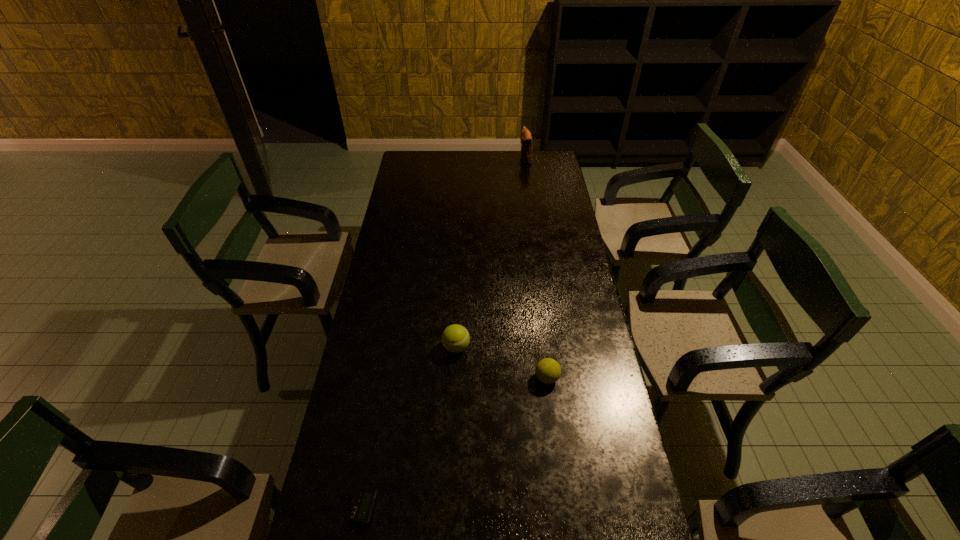
Where is `vacant space at the right edge of the desktop`? The image size is (960, 540). vacant space at the right edge of the desktop is located at coordinates (576, 424).

I want to click on free space at the far left corner of the desktop, so click(x=414, y=164).

The height and width of the screenshot is (540, 960). In order to click on empty space that is in between the nearer tennis ball and the shortest object in this screenshot , I will do `click(455, 443)`.

At what (x,y) coordinates should I click in order to perform the action: click on unoccupied position between the nearer tennis ball and the clutch bag. Please return your answer as a coordinate pair (x, y). The image size is (960, 540). Looking at the image, I should click on 536,268.

I want to click on vacant area that lies between the farthest object and the right tennis ball, so click(x=536, y=268).

This screenshot has height=540, width=960. In order to click on vacant space that is in between the tallest object and the second tallest object in this screenshot , I will do `click(491, 253)`.

At what (x,y) coordinates should I click in order to perform the action: click on free space between the left tennis ball and the shorter tennis ball. Please return your answer as a coordinate pair (x, y). Image resolution: width=960 pixels, height=540 pixels. Looking at the image, I should click on (501, 362).

Locate an element on the screen. empty location between the nearest object and the second object from left to right is located at coordinates pyautogui.click(x=410, y=428).

This screenshot has width=960, height=540. What are the coordinates of `vacant area between the nearest object and the second nearest object` in the screenshot? It's located at (455, 443).

Where is `blank region between the third farthest object and the second farthest object`? blank region between the third farthest object and the second farthest object is located at coordinates (501, 362).